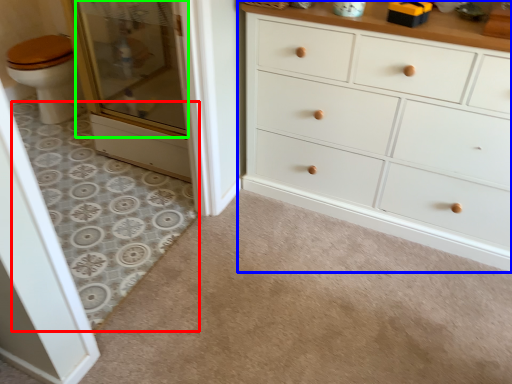
Question: Which is nearer to the plain (highlighted by a red box)? chest of drawers (highlighted by a blue box) or screen door (highlighted by a green box).

Choices:
 (A) chest of drawers
 (B) screen door

Answer: (B)